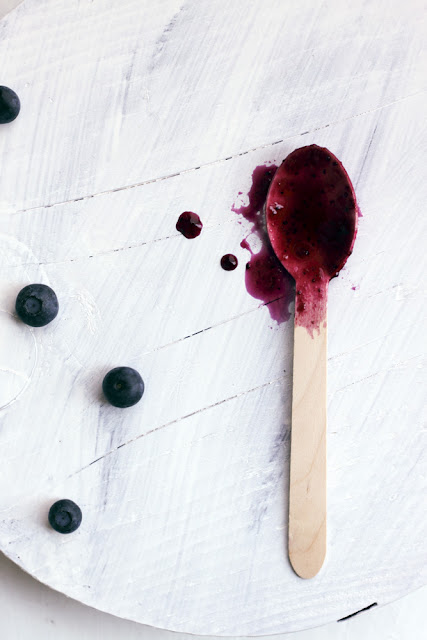
Locate an element on the screen. The width and height of the screenshot is (427, 640). paint is located at coordinates (168, 608).